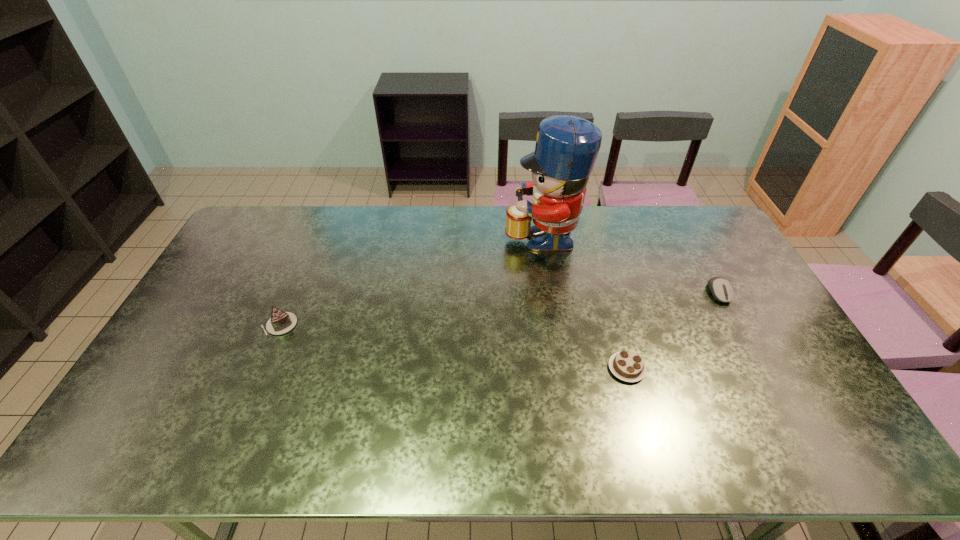
Locate an element on the screen. This screenshot has height=540, width=960. free space located on the front-facing side of the nutcracker is located at coordinates (447, 235).

Where is `vacant space located 0.100m on the right of the left chocolate cake`? vacant space located 0.100m on the right of the left chocolate cake is located at coordinates (330, 325).

Find the location of a particular element. free point located 0.220m on the wheel side of the third tallest object is located at coordinates (757, 363).

You are a GUI agent. You are given a task and a screenshot of the screen. Output one action in this format:
    pyautogui.click(x=<x>, y=<y>)
    Task: Click on the vacant space situated on the left of the nearer chocolate cake
    The height and width of the screenshot is (540, 960).
    Given the screenshot: What is the action you would take?
    pyautogui.click(x=499, y=368)

Find the location of a particular element. object that is positioned at the far edge is located at coordinates (567, 146).

Where is `object at the right edge`? object at the right edge is located at coordinates (721, 289).

What are the coordinates of `free region at the far edge of the desktop` in the screenshot? It's located at (592, 231).

Locate an element on the screen. free space at the near edge is located at coordinates (425, 446).

Locate an element on the screen. The width and height of the screenshot is (960, 540). free region at the left edge of the desktop is located at coordinates [x=219, y=312].

In the image, there is a desktop. Where is `vacant space at the right edge`? vacant space at the right edge is located at coordinates (789, 351).